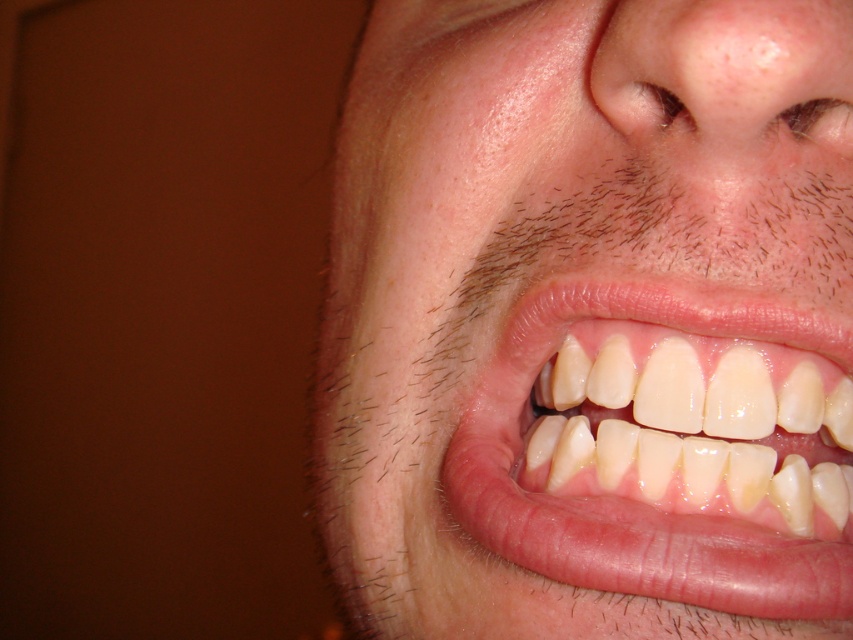
Question: Can you confirm if smooth skin at center is wider than white glossy teeth at center?

Choices:
 (A) no
 (B) yes

Answer: (B)

Question: Where is smooth skin at center located in relation to white glossy teeth at center in the image?

Choices:
 (A) left
 (B) right

Answer: (A)

Question: Which of the following is the closest to the observer?

Choices:
 (A) smooth skin at center
 (B) white glossy teeth at center

Answer: (A)

Question: Can you confirm if smooth skin at center is smaller than white glossy teeth at center?

Choices:
 (A) no
 (B) yes

Answer: (A)